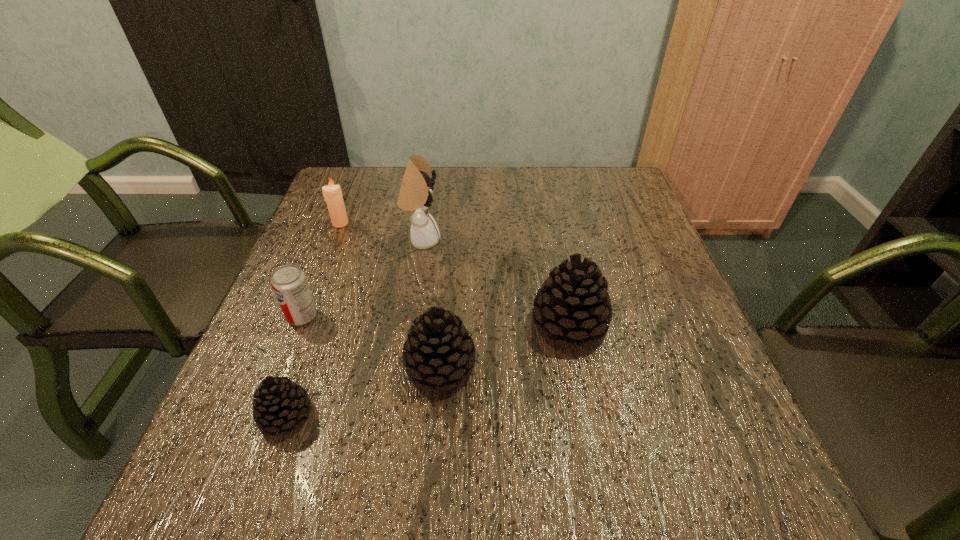
The image size is (960, 540). What are the coordinates of `blank area located at the narrow end of the rightmost object` in the screenshot? It's located at coord(359,324).

At what (x,y) coordinates should I click in order to perform the action: click on vacant space located 0.170m at the front face of the doll. Please return your answer as a coordinate pair (x, y). Looking at the image, I should click on (508, 240).

Where is `free region located 0.080m on the back of the candle`? The height and width of the screenshot is (540, 960). free region located 0.080m on the back of the candle is located at coordinates (348, 202).

The height and width of the screenshot is (540, 960). In order to click on vacant space situated 0.050m on the right of the fifth tallest object in this screenshot , I will do `click(341, 316)`.

Find the location of `pinecone that is at the left edge`. pinecone that is at the left edge is located at coordinates (280, 403).

Locate an element on the screen. This screenshot has width=960, height=540. candle that is at the left edge is located at coordinates (332, 194).

Find the location of a particular element. soda that is at the left edge is located at coordinates (289, 283).

Where is `object situated at the near left corner`? object situated at the near left corner is located at coordinates (280, 403).

In the image, there is a desktop. Identify the location of vacant space at the far edge. (526, 185).

This screenshot has height=540, width=960. I want to click on free point at the near edge, so click(456, 424).